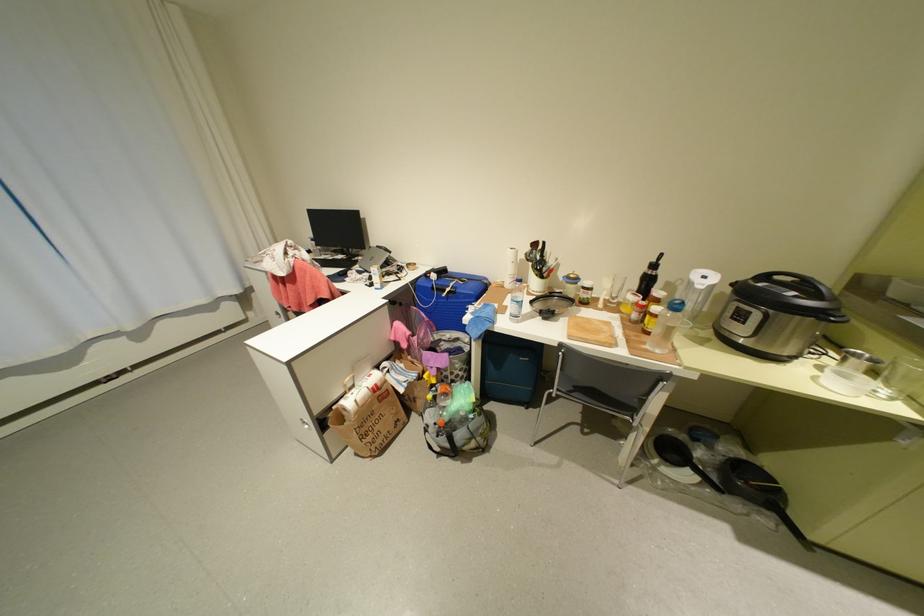
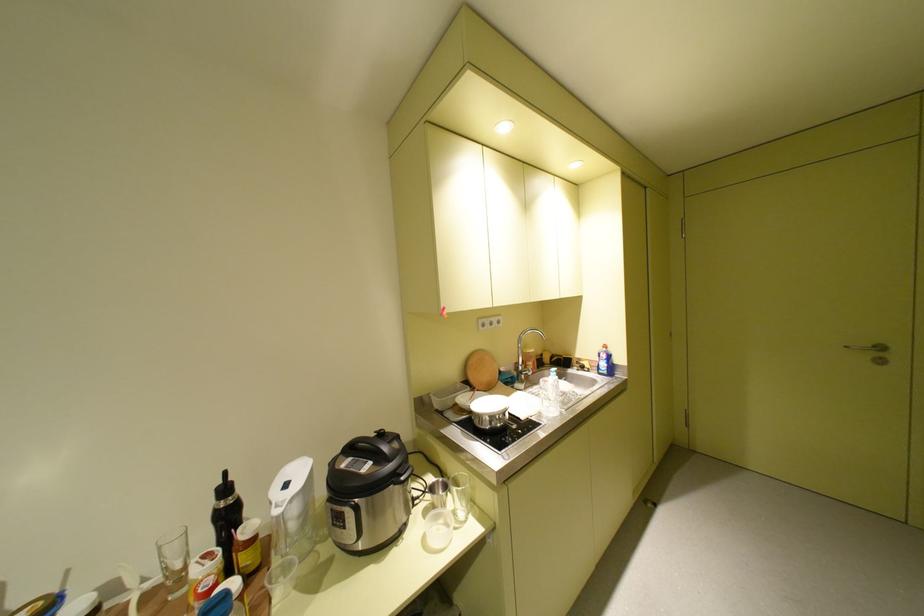
Locate, in the second image, the point that corresponds to point (871, 355) in the first image.

(450, 482)